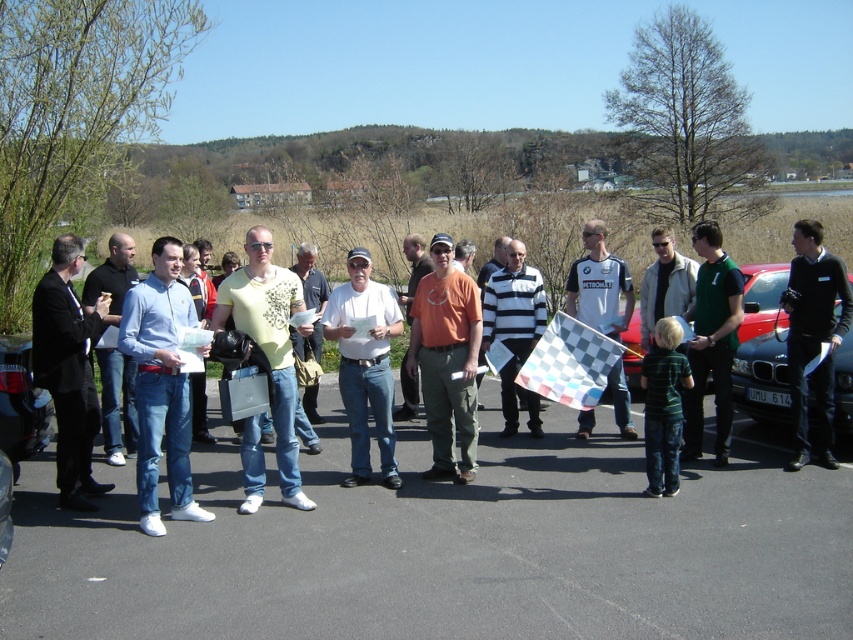
You are a photographer positioned at the edge of the paved area. You need to take a photo that includes both the black matte jacket at right and the checkered fabric flag at center. Can you see both objects in your current position without moving? Explain why or why not.

The black matte jacket at right is in front of the checkered fabric flag at center, so if the jacket is blocking the view of the flag, you might not see both clearly. Adjust your position to ensure both are visible.

You are standing at the origin point in the image and want to reach the black asphalt parking lot at center. Which direction should you move in to get there?

The black asphalt parking lot at center is located at point (450, 548), so you should move towards the northeast direction to reach it.

You are a photographer positioned to the left of the scene. You need to capture a photo where both the black matte jacket at right and the checkered fabric flag at center are clearly visible. Based on their positions, will the flag be visible without obstruction from the jacket?

The black matte jacket at right is above the checkered fabric flag at center, so the jacket may block the view of the flag from your position. Adjust your angle to ensure the flag is visible below the jacket.